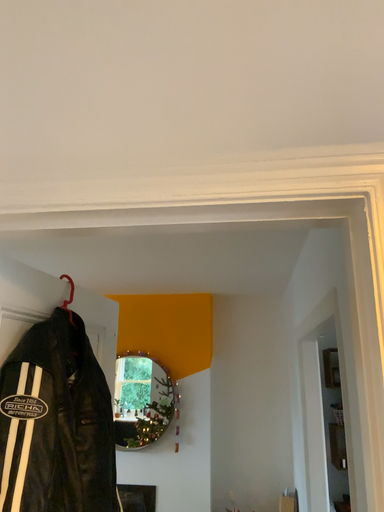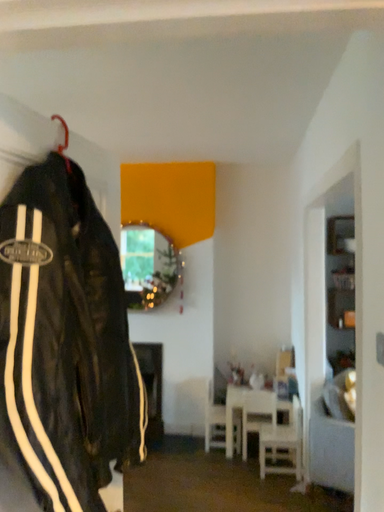
Question: How did the camera likely rotate when shooting the video?

Choices:
 (A) rotated upward
 (B) rotated downward

Answer: (B)